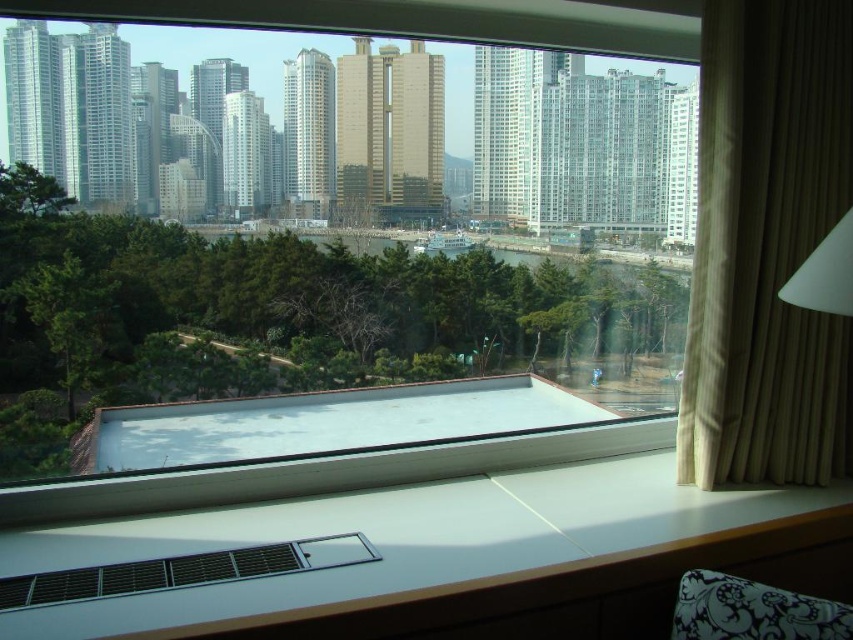
Can you confirm if beige fabric curtain at right is smaller than matte plastic vent at lower center?

Actually, beige fabric curtain at right might be larger than matte plastic vent at lower center.

Which is more to the right, beige fabric curtain at right or matte plastic vent at lower center?

From the viewer's perspective, beige fabric curtain at right appears more on the right side.

Is point (741, 422) farther from viewer compared to point (77, 588)?

Yes, point (741, 422) is farther from viewer.

Find the location of a particular element. This screenshot has width=853, height=640. beige fabric curtain at right is located at coordinates (x=767, y=246).

Can you confirm if transparent glass window at center is positioned to the left of beige fabric curtain at right?

Indeed, transparent glass window at center is positioned on the left side of beige fabric curtain at right.

Consider the image. Which is above, transparent glass window at center or beige fabric curtain at right?

transparent glass window at center is above.

Between point (222, 17) and point (788, 198), which one is positioned in front?

Point (222, 17) is in front.

Identify the location of transparent glass window at center. This screenshot has height=640, width=853. (318, 224).

Describe the element at coordinates (318, 224) in the screenshot. This screenshot has width=853, height=640. I see `transparent glass window at center` at that location.

Measure the distance between transparent glass window at center and camera.

They are 92.38 feet apart.

This screenshot has width=853, height=640. I want to click on transparent glass window at center, so click(x=318, y=224).